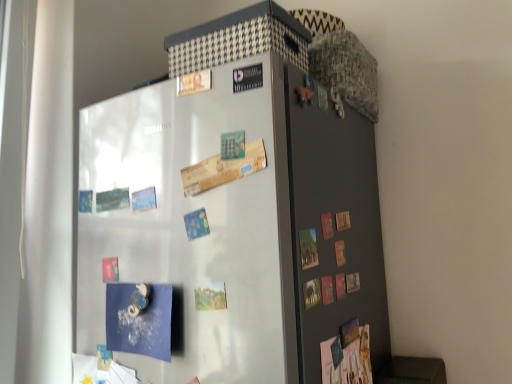
The height and width of the screenshot is (384, 512). What do you see at coordinates (230, 230) in the screenshot?
I see `satin silver fridge at center` at bounding box center [230, 230].

The height and width of the screenshot is (384, 512). What are the coordinates of `satin silver fridge at center` in the screenshot? It's located at (230, 230).

In order to face matte gray door at right, should I rotate leftwards or rightwards?

Rotate your view right by about 9.878°.

What do you see at coordinates (333, 228) in the screenshot? Image resolution: width=512 pixels, height=384 pixels. I see `matte gray door at right` at bounding box center [333, 228].

Identify the location of matte gray door at right. This screenshot has height=384, width=512. (333, 228).

Identify the location of satin silver fridge at center. (230, 230).

Which object is positioned more to the right, matte gray door at right or satin silver fridge at center?

matte gray door at right.

In the scene shown: Between matte gray door at right and satin silver fridge at center, which one is positioned behind?

Positioned behind is matte gray door at right.

Considering the positions of points (297, 230) and (303, 194), is point (297, 230) farther from camera compared to point (303, 194)?

No, it is in front of (303, 194).

From the image's perspective, which is above, matte gray door at right or satin silver fridge at center?

matte gray door at right, from the image's perspective.

From a real-world perspective, between matte gray door at right and satin silver fridge at center, who is vertically higher?

In real-world perspective, matte gray door at right is above.

Is matte gray door at right thinner than satin silver fridge at center?

Correct, the width of matte gray door at right is less than that of satin silver fridge at center.

Can you confirm if matte gray door at right is taller than satin silver fridge at center?

No.

Who is smaller, matte gray door at right or satin silver fridge at center?

matte gray door at right.

Is satin silver fridge at center completely or partially inside matte gray door at right?

Actually, satin silver fridge at center is outside matte gray door at right.

Are matte gray door at right and satin silver fridge at center located far from each other?

Actually, matte gray door at right and satin silver fridge at center are a little close together.

Could you tell me if matte gray door at right is turned towards satin silver fridge at center?

Yes, matte gray door at right faces towards satin silver fridge at center.

How many degrees apart are the facing directions of matte gray door at right and satin silver fridge at center?

90.9 degrees.

Measure the distance from matte gray door at right to satin silver fridge at center.

They are 6.15 inches apart.

You are a GUI agent. You are given a task and a screenshot of the screen. Output one action in this format:
    pyautogui.click(x=<x>, y=<y>)
    Task: Click on the refrigerator that is on the left side of matte gray door at right
    
    Given the screenshot: What is the action you would take?
    pyautogui.click(x=230, y=230)

Considering the relative positions of satin silver fridge at center and matte gray door at right in the image provided, is satin silver fridge at center to the right of matte gray door at right from the viewer's perspective?

No.

Considering their positions, is satin silver fridge at center located in front of or behind matte gray door at right?

satin silver fridge at center is positioned closer to the viewer than matte gray door at right.

Considering the points (266, 67) and (358, 132), which point is behind, point (266, 67) or point (358, 132)?

The point (358, 132) is more distant.

From the image's perspective, who appears lower, satin silver fridge at center or matte gray door at right?

satin silver fridge at center.

From a real-world perspective, is satin silver fridge at center physically located above or below matte gray door at right?

In terms of real-world spatial position, satin silver fridge at center is below matte gray door at right.

Can you confirm if satin silver fridge at center is wider than matte gray door at right?

Yes, satin silver fridge at center is wider than matte gray door at right.

Does satin silver fridge at center have a greater height compared to matte gray door at right?

Indeed, satin silver fridge at center has a greater height compared to matte gray door at right.

In the scene shown: In terms of size, does satin silver fridge at center appear bigger or smaller than matte gray door at right?

In the image, satin silver fridge at center appears to be larger than matte gray door at right.

Which is correct: satin silver fridge at center is inside matte gray door at right, or outside of it?

The correct answer is: outside.

Is satin silver fridge at center in contact with matte gray door at right?

No.

Is satin silver fridge at center oriented away from matte gray door at right?

No, satin silver fridge at center is not facing away from matte gray door at right.

Can you tell me how much satin silver fridge at center and matte gray door at right differ in facing direction?

satin silver fridge at center and matte gray door at right are facing 90.9 degrees away from each other.

In the image, there is a matte gray door at right. Where is `refrigerator below it (from a real-world perspective)`? Image resolution: width=512 pixels, height=384 pixels. refrigerator below it (from a real-world perspective) is located at coordinates (230, 230).

Locate an element on the screen. door above the satin silver fridge at center (from the image's perspective) is located at coordinates [x=333, y=228].

Find the location of a particular element. refrigerator in front of the matte gray door at right is located at coordinates (230, 230).